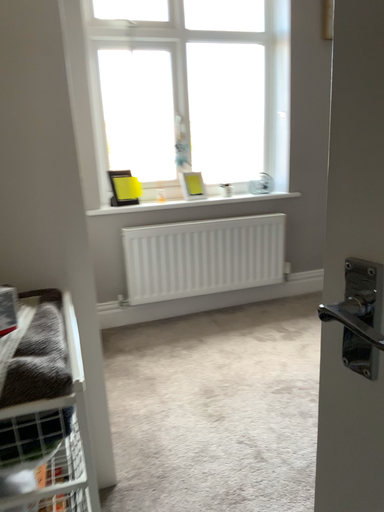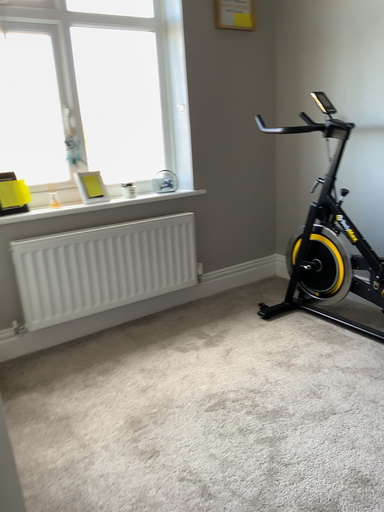
Question: How did the camera likely rotate when shooting the video?

Choices:
 (A) rotated right
 (B) rotated left

Answer: (A)